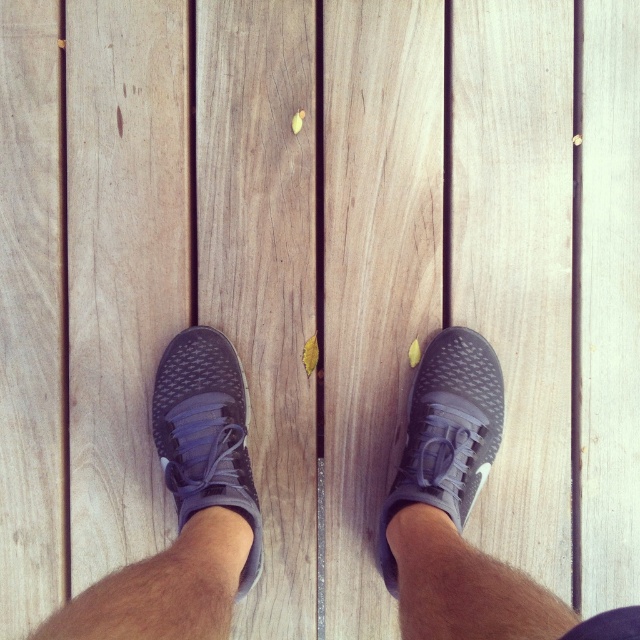
Who is lower down, matte gray sneakers at center or matte gray shoe at center?

matte gray sneakers at center is below.

From the picture: Between matte gray sneakers at center and matte gray shoe at center, which one is positioned higher?

Positioned higher is matte gray shoe at center.

Locate an element on the screen. The width and height of the screenshot is (640, 640). matte gray sneakers at center is located at coordinates (464, 513).

Can you confirm if matte gray shoe at lower left is positioned to the right of matte gray shoe at lower right?

No, matte gray shoe at lower left is not to the right of matte gray shoe at lower right.

Can you confirm if matte gray shoe at lower left is shorter than matte gray shoe at lower right?

Correct, matte gray shoe at lower left is not as tall as matte gray shoe at lower right.

Identify the location of matte gray shoe at lower left. Image resolution: width=640 pixels, height=640 pixels. (186, 508).

Who is shorter, matte gray shoe at center or matte gray shoe at lower right?

matte gray shoe at center

Which is behind, point (179, 461) or point (420, 445)?

Positioned behind is point (420, 445).

This screenshot has width=640, height=640. Identify the location of matte gray shoe at center. (205, 433).